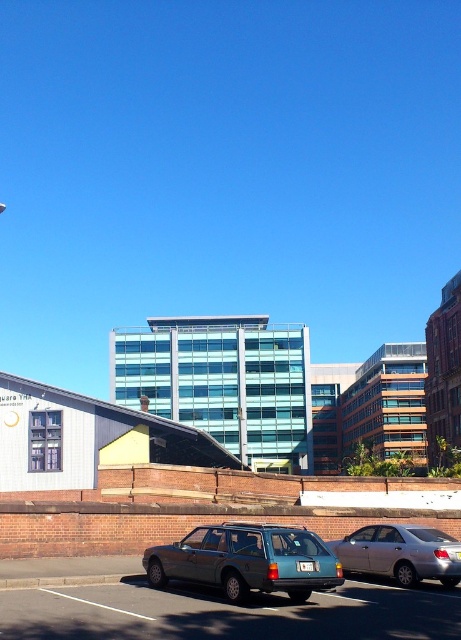
Question: Can you confirm if teal matte station wagon at center is thinner than silver metallic sedan at center?

Choices:
 (A) no
 (B) yes

Answer: (A)

Question: Can you confirm if teal matte station wagon at center is positioned to the left of silver metallic sedan at center?

Choices:
 (A) no
 (B) yes

Answer: (B)

Question: Which object appears closest to the camera in this image?

Choices:
 (A) teal matte station wagon at center
 (B) silver metallic sedan at center

Answer: (A)

Question: Is teal matte station wagon at center bigger than silver metallic sedan at center?

Choices:
 (A) yes
 (B) no

Answer: (A)